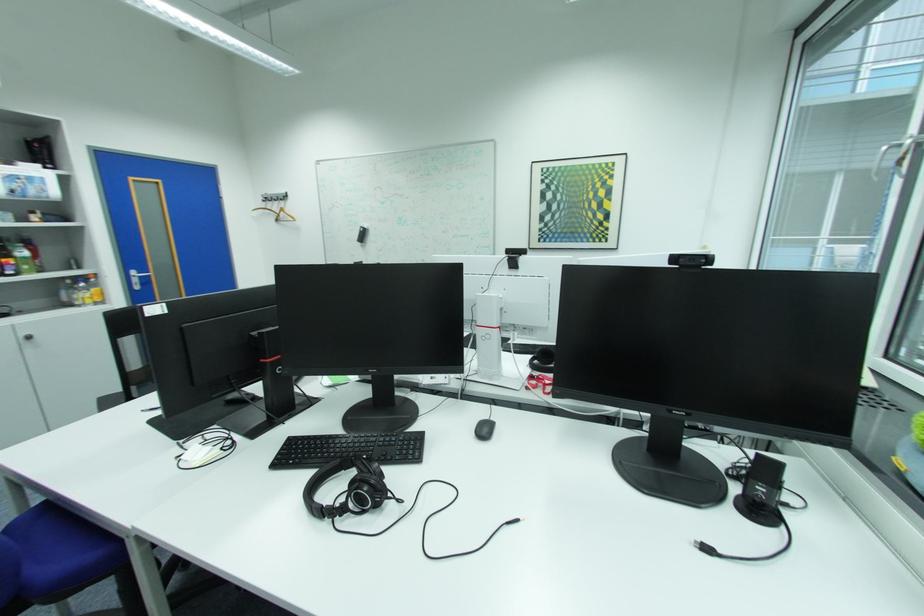
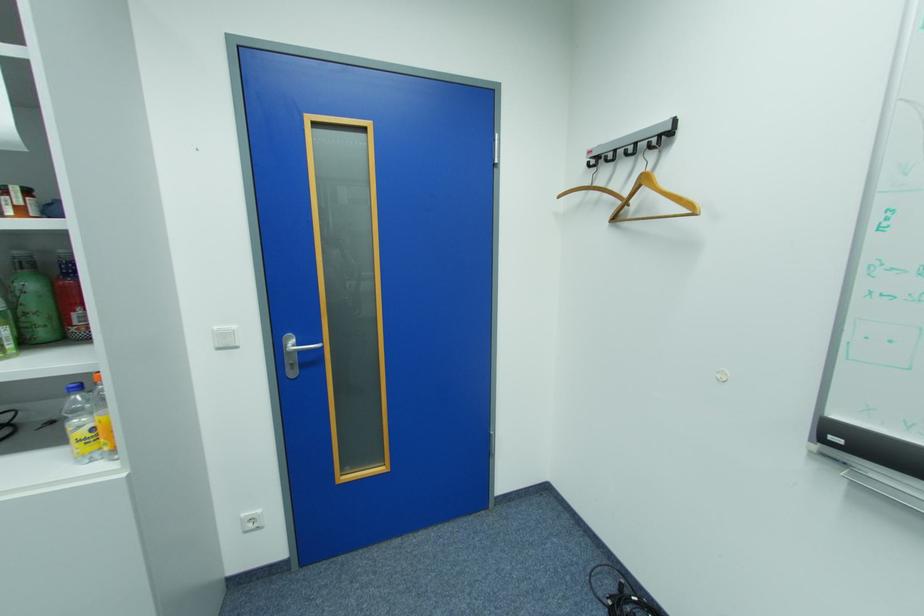
Where in the second image is the point corresponding to (274,199) from the first image?

(606, 159)